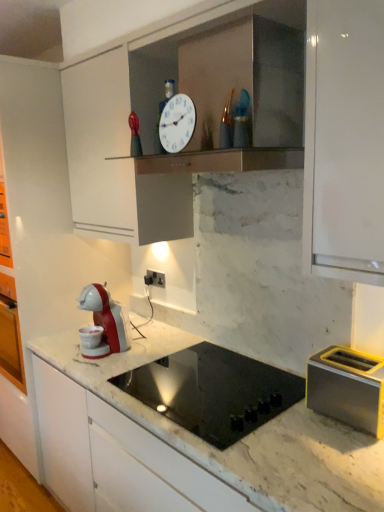
Question: Is black plastic electric outlet at center behind black glass cooktop at center?

Choices:
 (A) no
 (B) yes

Answer: (B)

Question: Is black plastic electric outlet at center taller than black glass cooktop at center?

Choices:
 (A) no
 (B) yes

Answer: (A)

Question: Considering the relative positions of black plastic electric outlet at center and black glass cooktop at center in the image provided, is black plastic electric outlet at center to the left of black glass cooktop at center from the viewer's perspective?

Choices:
 (A) no
 (B) yes

Answer: (B)

Question: Is black glass cooktop at center located within black plastic electric outlet at center?

Choices:
 (A) yes
 (B) no

Answer: (B)

Question: Would you say black plastic electric outlet at center is a long distance from black glass cooktop at center?

Choices:
 (A) yes
 (B) no

Answer: (B)

Question: Is metallic yellow toaster at right wider or thinner than black plastic electric outlet at center?

Choices:
 (A) thin
 (B) wide

Answer: (B)

Question: Is metallic yellow toaster at right to the left or to the right of black plastic electric outlet at center in the image?

Choices:
 (A) left
 (B) right

Answer: (B)

Question: In terms of height, does metallic yellow toaster at right look taller or shorter compared to black plastic electric outlet at center?

Choices:
 (A) short
 (B) tall

Answer: (B)

Question: Is metallic yellow toaster at right spatially inside black plastic electric outlet at center, or outside of it?

Choices:
 (A) inside
 (B) outside

Answer: (B)

Question: Is white glossy clock at upper center in front of or behind metallic yellow toaster at right in the image?

Choices:
 (A) front
 (B) behind

Answer: (B)

Question: From the image's perspective, relative to metallic yellow toaster at right, is white glossy clock at upper center above or below?

Choices:
 (A) above
 (B) below

Answer: (A)

Question: Which is correct: white glossy clock at upper center is inside metallic yellow toaster at right, or outside of it?

Choices:
 (A) outside
 (B) inside

Answer: (A)

Question: Does point (182, 94) appear closer or farther from the camera than point (329, 348)?

Choices:
 (A) closer
 (B) farther

Answer: (B)

Question: Considering the relative positions of black glass cooktop at center and black plastic electric outlet at center in the image provided, is black glass cooktop at center to the left or to the right of black plastic electric outlet at center?

Choices:
 (A) left
 (B) right

Answer: (B)

Question: From a real-world perspective, is black glass cooktop at center above or below black plastic electric outlet at center?

Choices:
 (A) below
 (B) above

Answer: (A)